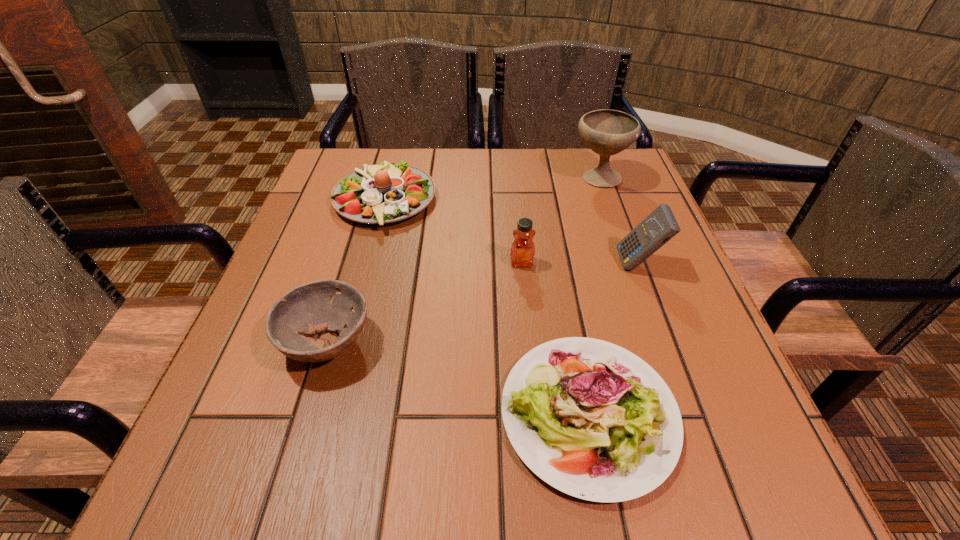
Identify the location of salad plate present at the left edge. (387, 192).

Locate an element on the screen. chalice that is at the right edge is located at coordinates (607, 132).

You are a GUI agent. You are given a task and a screenshot of the screen. Output one action in this format:
    pyautogui.click(x=<x>, y=<y>)
    Task: Click on the calculator at the right edge
    This screenshot has height=540, width=960.
    Given the screenshot: What is the action you would take?
    click(x=660, y=226)

The image size is (960, 540). What are the coordinates of `salad plate at the right edge` in the screenshot? It's located at (590, 418).

Where is `object situated at the far left corner`? The image size is (960, 540). object situated at the far left corner is located at coordinates [x=387, y=192].

The height and width of the screenshot is (540, 960). In order to click on object situated at the far right corner in this screenshot , I will do `click(607, 132)`.

Where is `object at the near right corner`? The image size is (960, 540). object at the near right corner is located at coordinates (590, 418).

This screenshot has height=540, width=960. I want to click on free space at the far edge of the desktop, so click(549, 184).

Image resolution: width=960 pixels, height=540 pixels. I want to click on vacant space at the near edge, so click(x=444, y=493).

Locate an element on the screen. This screenshot has width=960, height=540. vacant space at the left edge of the desktop is located at coordinates (319, 388).